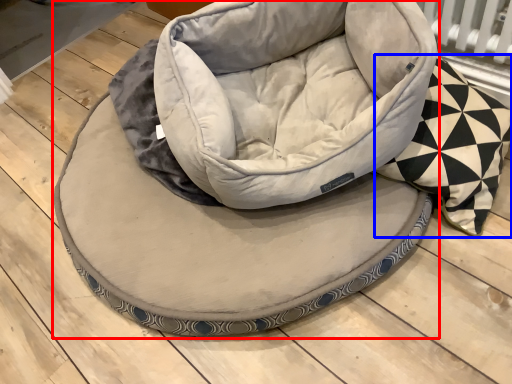
Question: Which object appears closest to the camera in this image, dog bed (highlighted by a red box) or throw pillow (highlighted by a blue box)?

Choices:
 (A) dog bed
 (B) throw pillow

Answer: (B)